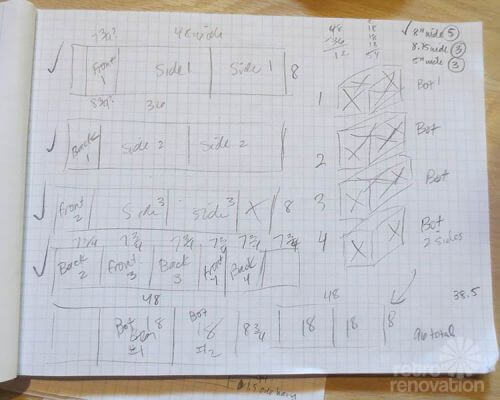
Where is `wooden surface`? This screenshot has width=500, height=400. wooden surface is located at coordinates (355, 6), (119, 388).